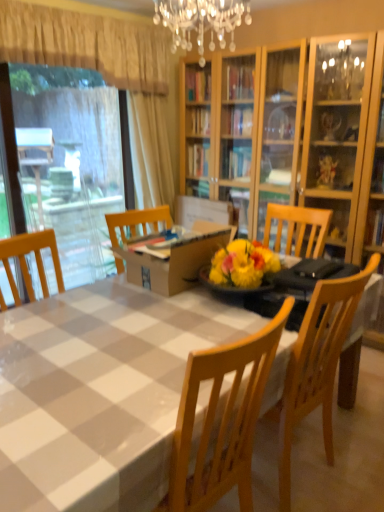
Question: From the image's perspective, is white checkered tablecloth at center over wooden chair at center?

Choices:
 (A) yes
 (B) no

Answer: (B)

Question: Can we say white checkered tablecloth at center lies outside wooden chair at center?

Choices:
 (A) no
 (B) yes

Answer: (B)

Question: Considering the relative positions of white checkered tablecloth at center and wooden chair at center in the image provided, is white checkered tablecloth at center behind wooden chair at center?

Choices:
 (A) yes
 (B) no

Answer: (B)

Question: Considering the relative sizes of white checkered tablecloth at center and wooden chair at center in the image provided, is white checkered tablecloth at center taller than wooden chair at center?

Choices:
 (A) no
 (B) yes

Answer: (A)

Question: Are white checkered tablecloth at center and wooden chair at center making contact?

Choices:
 (A) no
 (B) yes

Answer: (A)

Question: From a real-world perspective, is white checkered tablecloth at center on wooden chair at center?

Choices:
 (A) no
 (B) yes

Answer: (A)

Question: Considering the relative sizes of wooden chair at center and white checkered tablecloth at center in the image provided, is wooden chair at center wider than white checkered tablecloth at center?

Choices:
 (A) yes
 (B) no

Answer: (B)

Question: From a real-world perspective, is wooden chair at center under white checkered tablecloth at center?

Choices:
 (A) no
 (B) yes

Answer: (A)

Question: Considering the relative sizes of wooden chair at center and white checkered tablecloth at center in the image provided, is wooden chair at center taller than white checkered tablecloth at center?

Choices:
 (A) no
 (B) yes

Answer: (B)

Question: Is wooden chair at center surrounding white checkered tablecloth at center?

Choices:
 (A) yes
 (B) no

Answer: (B)

Question: From the image's perspective, is wooden chair at center above white checkered tablecloth at center?

Choices:
 (A) no
 (B) yes

Answer: (B)

Question: Does wooden chair at center appear on the left side of white checkered tablecloth at center?

Choices:
 (A) yes
 (B) no

Answer: (B)

Question: Is brown cardboard box at center shorter than white checkered tablecloth at center?

Choices:
 (A) yes
 (B) no

Answer: (A)